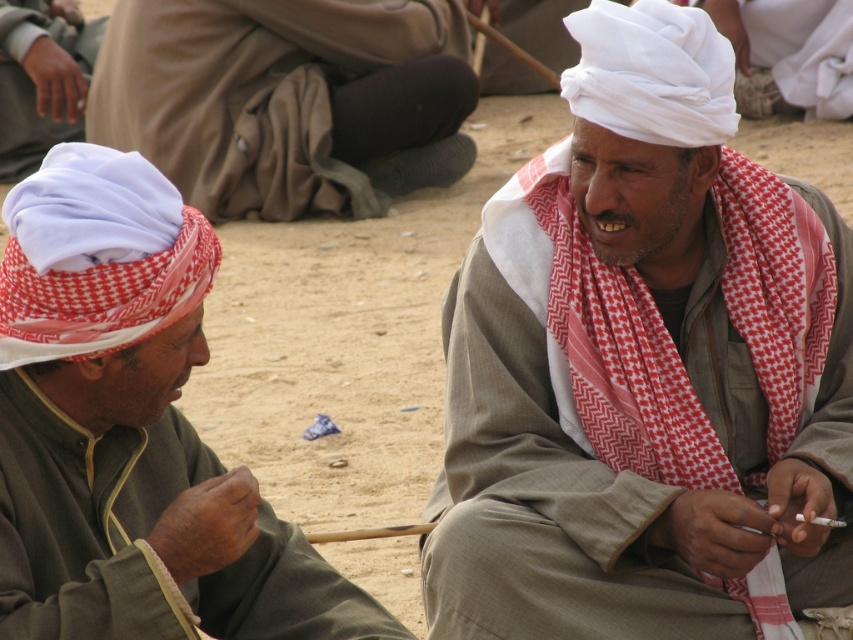
Can you confirm if white woven turban at center is positioned to the left of white cotton turban at left?

No, white woven turban at center is not to the left of white cotton turban at left.

Between point (770, 179) and point (248, 506), which one is positioned in front?

Point (248, 506) is more forward.

Where is `white woven turban at center`? white woven turban at center is located at coordinates pos(637,371).

Is white cotton turban at left positioned behind white cotton turban at upper left?

No, white cotton turban at left is closer to the viewer.

Is white cotton turban at left to the left of white cotton turban at upper left from the viewer's perspective?

No, white cotton turban at left is not to the left of white cotton turban at upper left.

Where is `white cotton turban at left`? white cotton turban at left is located at coordinates (128, 429).

Between white woven turban at center and white cloth at upper left, which one has more height?

With more height is white woven turban at center.

Is the position of white woven turban at center less distant than that of white cloth at upper left?

Yes, white woven turban at center is closer to the viewer.

The height and width of the screenshot is (640, 853). I want to click on white woven turban at center, so (x=637, y=371).